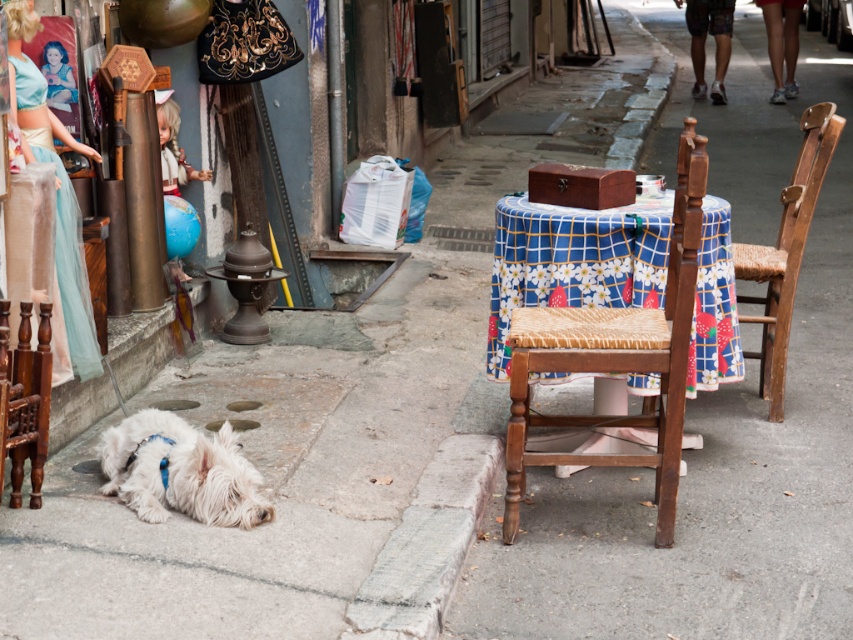
Question: Which object is farther from the camera taking this photo?

Choices:
 (A) woven wood chair at right
 (B) gray concrete curb at lower center

Answer: (A)

Question: Which point appears farthest from the camera in this image?

Choices:
 (A) (137, 477)
 (B) (672, 502)

Answer: (B)

Question: Is white fluffy dog at lower left positioned before woven wood chair at right?

Choices:
 (A) no
 (B) yes

Answer: (B)

Question: Does woven wood chair at center lie in front of woven wood chair at right?

Choices:
 (A) yes
 (B) no

Answer: (A)

Question: Based on their relative distances, which object is farther from the white fluffy dog at lower left?

Choices:
 (A) blue floral tablecloth at center
 (B) woven wood chair at right

Answer: (B)

Question: Can you confirm if woven wood chair at center is thinner than woven wood chair at right?

Choices:
 (A) no
 (B) yes

Answer: (A)